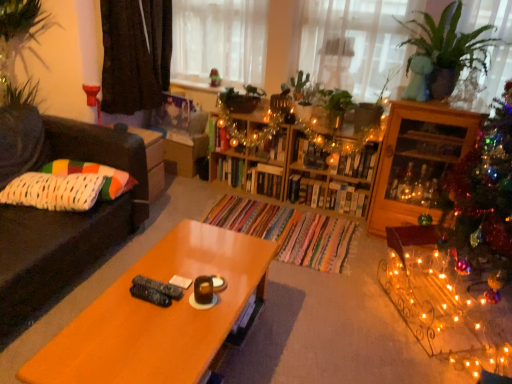
Where is `free area in between wooden bookshelf at center, positioned as the first shelf in right-to-left order, and wooden coffee table at center`? free area in between wooden bookshelf at center, positioned as the first shelf in right-to-left order, and wooden coffee table at center is located at coordinates point(295,251).